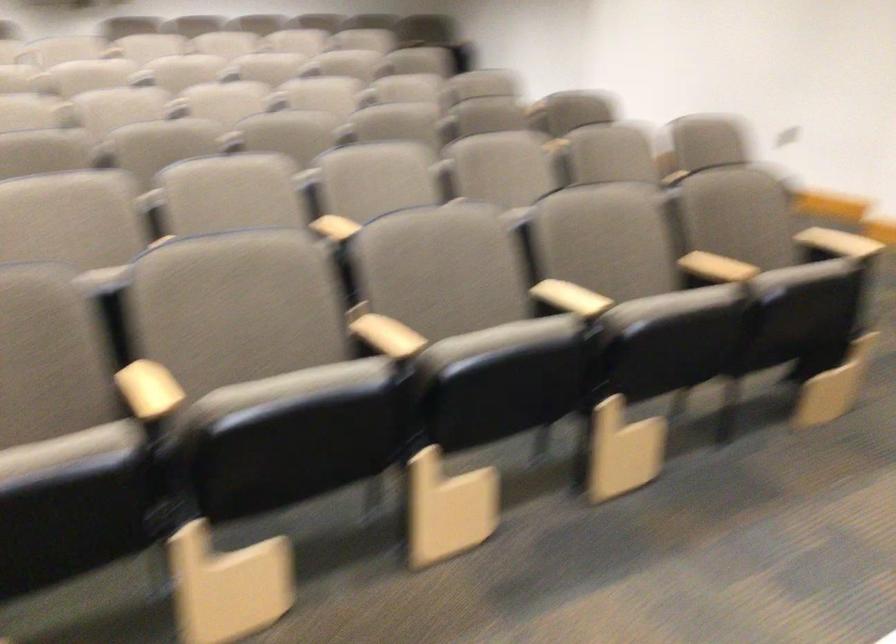
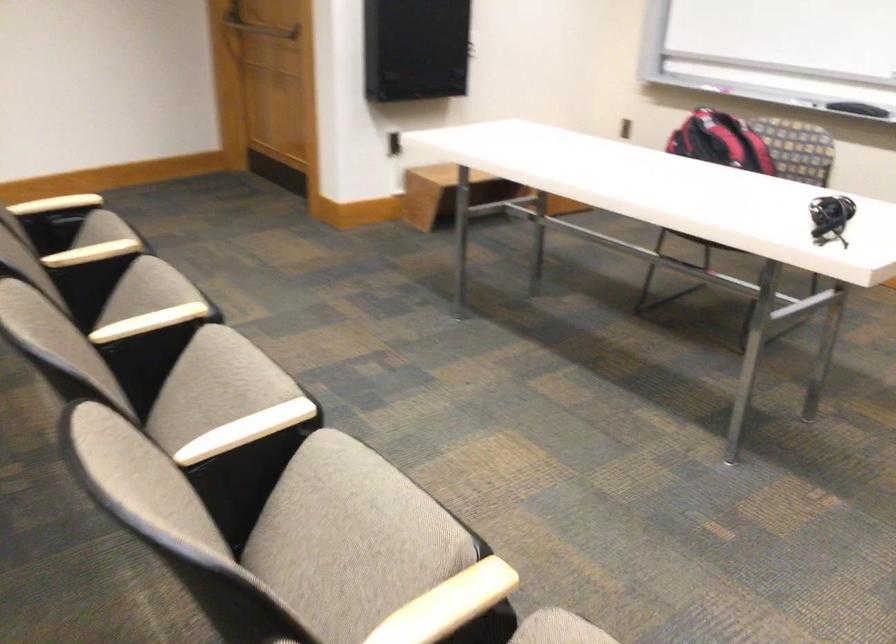
Question: I am providing you with two images of the same scene from different viewpoints. Which of the following objects are not visible in image2?

Choices:
 (A) black whiteboard eraser
 (B) red and black backpack
 (C) small black device
 (D) none of these

Answer: (D)